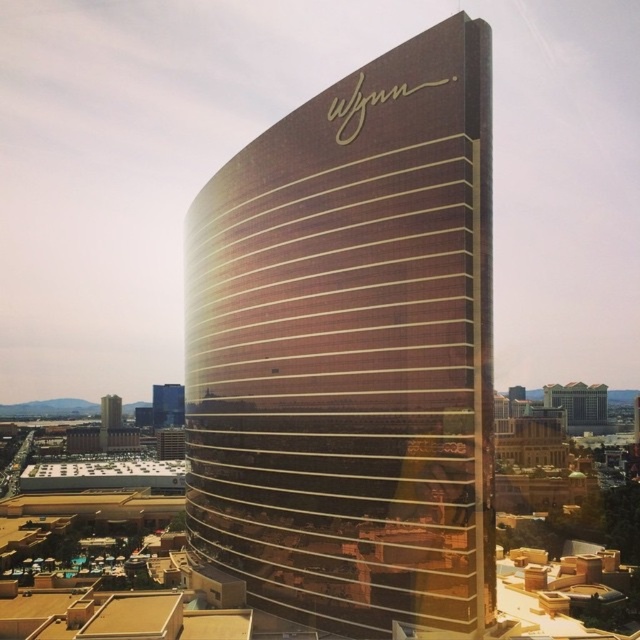
You are a drone operator who needs to fly a drone from the gold reflective glass building at center to the gold reflective hotel at center. The drone has a maximum flight range of 500 meters. Can the drone make the trip without needing to recharge?

The distance between the gold reflective glass building at center and the gold reflective hotel at center is 472.13 meters, which is within the drone operator drone has a maximum flight range of 500 meters. The drone can make the trip without needing to recharge.

You are standing on the observation deck of the gold reflective glass tower at lower left and looking towards the shiny glass skyscraper at center. Which building appears taller from your vantage point?

The shiny glass skyscraper at center appears taller than the gold reflective glass tower at lower left because it is much taller in reality.